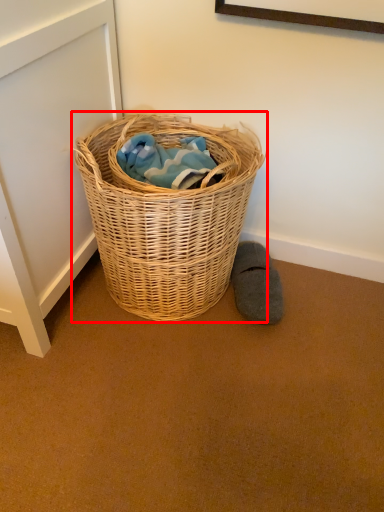
Question: From the image's perspective, what is the correct spatial relationship of picnic basket (annotated by the red box) in relation to footwear?

Choices:
 (A) below
 (B) above

Answer: (B)